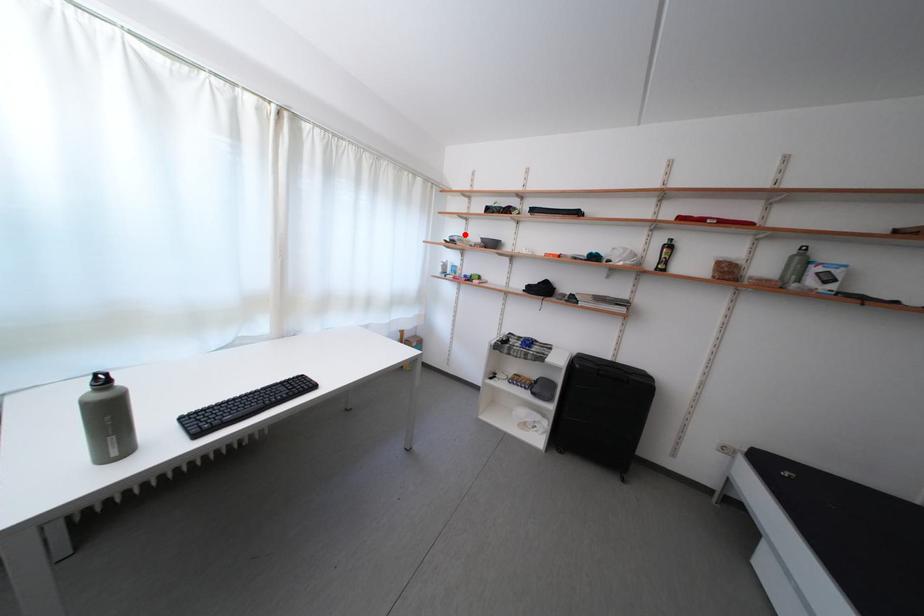
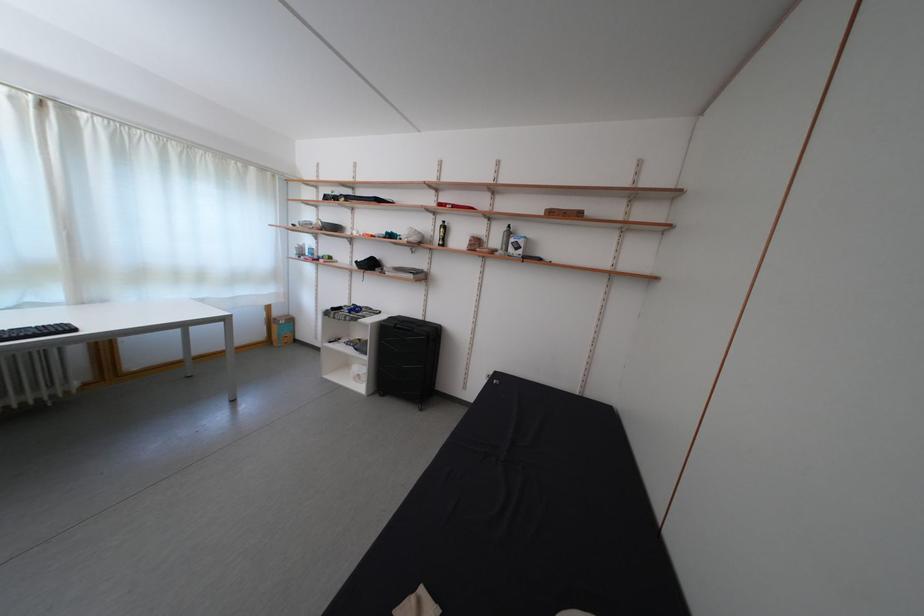
Where in the second image is the point corresponding to the highlighted location from the first image?

(319, 221)